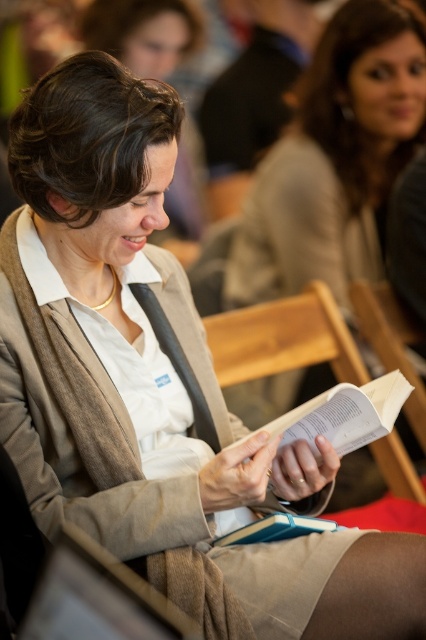
Question: Which object is closer to the camera taking this photo?

Choices:
 (A) beige woolen cardigan at center
 (B) wooden chair at center

Answer: (A)

Question: Is beige woolen cardigan at center thinner than wooden chair at center?

Choices:
 (A) yes
 (B) no

Answer: (B)

Question: Is beige woolen cardigan at center above wooden chair at center?

Choices:
 (A) yes
 (B) no

Answer: (B)

Question: Is beige woolen cardigan at center positioned in front of wooden chair at center?

Choices:
 (A) no
 (B) yes

Answer: (B)